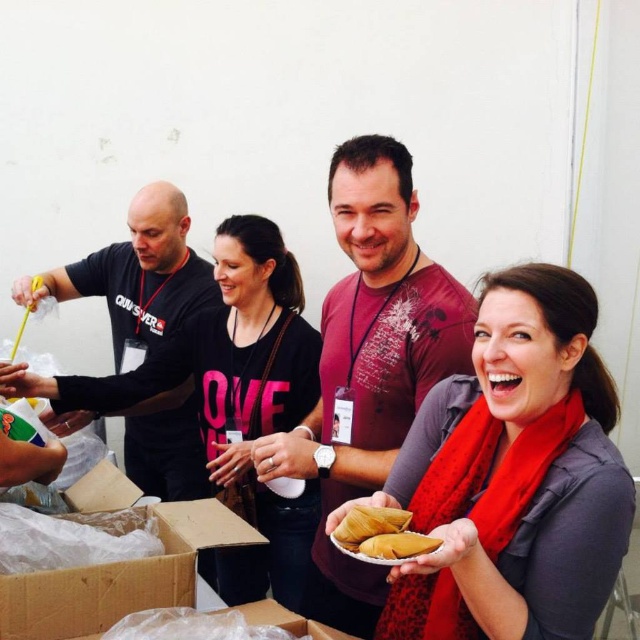
Question: Which is nearer to the yellow matte tamales at center?

Choices:
 (A) gray matte scarf at center
 (B) golden paper-like tamales at lower center

Answer: (B)

Question: Does matte black shirt at center lie behind black matte shirt at left?

Choices:
 (A) yes
 (B) no

Answer: (B)

Question: Which point appears farthest from the camera in this image?

Choices:
 (A) (449, 452)
 (B) (406, 550)

Answer: (A)

Question: Does gray matte scarf at center lie behind golden paper-like tamales at lower center?

Choices:
 (A) yes
 (B) no

Answer: (B)

Question: From the image, what is the correct spatial relationship of matte black shirt at center in relation to black matte shirt at left?

Choices:
 (A) right
 (B) left

Answer: (A)

Question: Which point is farther from the camera taking this photo?

Choices:
 (A) (412, 260)
 (B) (156, 477)
 (C) (417, 545)

Answer: (B)